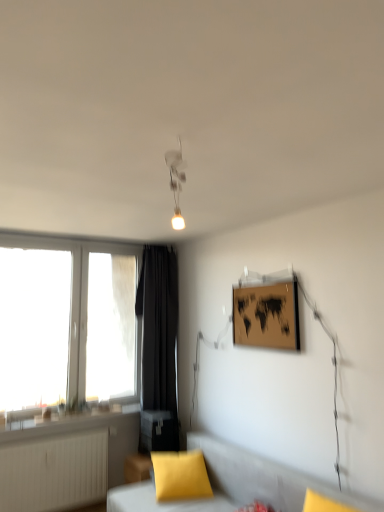
Question: Are soft gray cushion at lower center and wooden matte picture frame at upper right far apart?

Choices:
 (A) no
 (B) yes

Answer: (B)

Question: Is the depth of soft gray cushion at lower center less than that of wooden matte picture frame at upper right?

Choices:
 (A) no
 (B) yes

Answer: (B)

Question: Is soft gray cushion at lower center to the right of wooden matte picture frame at upper right from the viewer's perspective?

Choices:
 (A) no
 (B) yes

Answer: (A)

Question: Considering the relative sizes of soft gray cushion at lower center and wooden matte picture frame at upper right in the image provided, is soft gray cushion at lower center wider than wooden matte picture frame at upper right?

Choices:
 (A) yes
 (B) no

Answer: (A)

Question: From the image's perspective, is soft gray cushion at lower center under wooden matte picture frame at upper right?

Choices:
 (A) yes
 (B) no

Answer: (A)

Question: From the image's perspective, relative to black fabric curtain at left, is matte white ceiling light at upper center above or below?

Choices:
 (A) above
 (B) below

Answer: (A)

Question: In the image, is matte white ceiling light at upper center positioned in front of or behind black fabric curtain at left?

Choices:
 (A) behind
 (B) front

Answer: (B)

Question: From a real-world perspective, relative to black fabric curtain at left, is matte white ceiling light at upper center vertically above or below?

Choices:
 (A) below
 (B) above

Answer: (B)

Question: Looking at the image, does matte white ceiling light at upper center seem bigger or smaller compared to black fabric curtain at left?

Choices:
 (A) big
 (B) small

Answer: (B)

Question: Considering the positions of black fabric curtain at left and matte white ceiling light at upper center in the image, is black fabric curtain at left wider or thinner than matte white ceiling light at upper center?

Choices:
 (A) thin
 (B) wide

Answer: (B)

Question: Considering the positions of black fabric curtain at left and matte white ceiling light at upper center in the image, is black fabric curtain at left bigger or smaller than matte white ceiling light at upper center?

Choices:
 (A) big
 (B) small

Answer: (A)

Question: Considering the positions of black fabric curtain at left and matte white ceiling light at upper center in the image, is black fabric curtain at left taller or shorter than matte white ceiling light at upper center?

Choices:
 (A) short
 (B) tall

Answer: (B)

Question: Considering the positions of point [155, 420] and point [178, 221], is point [155, 420] closer or farther from the camera than point [178, 221]?

Choices:
 (A) farther
 (B) closer

Answer: (A)

Question: Is white plastic window at left in front of or behind wooden matte picture frame at upper right in the image?

Choices:
 (A) front
 (B) behind

Answer: (B)

Question: Considering the positions of white plastic window at left and wooden matte picture frame at upper right in the image, is white plastic window at left wider or thinner than wooden matte picture frame at upper right?

Choices:
 (A) wide
 (B) thin

Answer: (A)